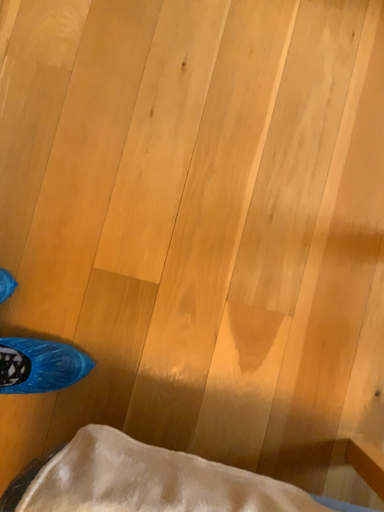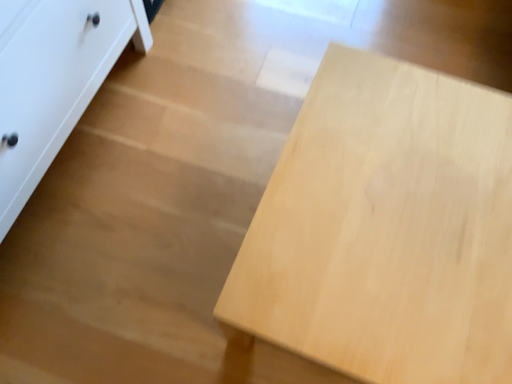
Question: How did the camera likely rotate when shooting the video?

Choices:
 (A) rotated upward
 (B) rotated downward

Answer: (A)